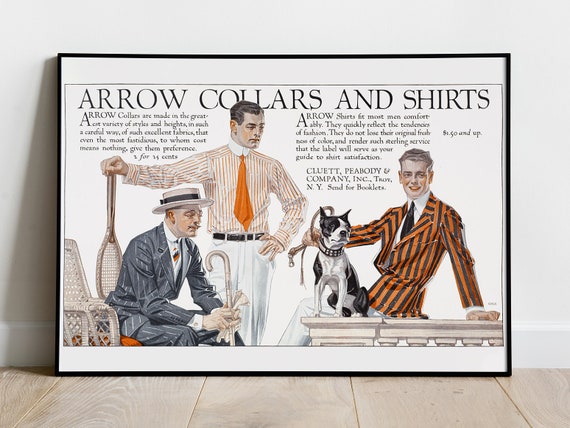
Locate an element on the screen. Image resolution: width=570 pixels, height=428 pixels. floor is located at coordinates (302, 396).